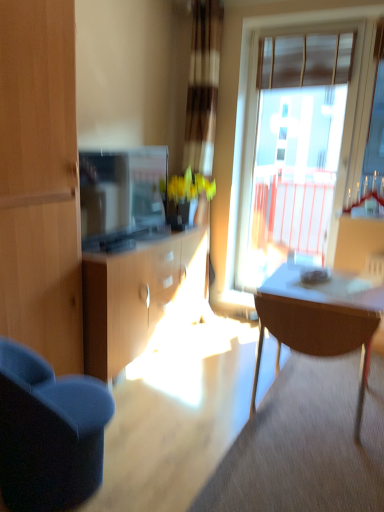
Image resolution: width=384 pixels, height=512 pixels. Describe the element at coordinates (320, 319) in the screenshot. I see `matte brown table at right` at that location.

What is the approximate height of matte brown table at right?

matte brown table at right is 29.57 inches in height.

Identify the location of matte brown table at right. The height and width of the screenshot is (512, 384). (320, 319).

The width and height of the screenshot is (384, 512). In order to click on translucent glass window at upper right in this screenshot , I will do `click(296, 144)`.

Describe the element at coordinates (296, 144) in the screenshot. Image resolution: width=384 pixels, height=512 pixels. I see `translucent glass window at upper right` at that location.

Find the location of `matte brown table at right`. matte brown table at right is located at coordinates (320, 319).

In the scene shown: Is matte brown table at right to the right of translucent glass window at upper right from the viewer's perspective?

No, matte brown table at right is not to the right of translucent glass window at upper right.

Which object is further away from the camera taking this photo, matte brown table at right or translucent glass window at upper right?

translucent glass window at upper right.

Does point (313, 294) appear closer or farther from the camera than point (244, 289)?

Point (313, 294) is closer to the camera than point (244, 289).

From the image's perspective, which object appears higher, matte brown table at right or translucent glass window at upper right?

translucent glass window at upper right, from the image's perspective.

From a real-world perspective, is matte brown table at right beneath translucent glass window at upper right?

Yes.

Considering the relative sizes of matte brown table at right and translucent glass window at upper right in the image provided, is matte brown table at right thinner than translucent glass window at upper right?

No, matte brown table at right is not thinner than translucent glass window at upper right.

From their relative heights in the image, would you say matte brown table at right is taller or shorter than translucent glass window at upper right?

In the image, matte brown table at right appears to be shorter than translucent glass window at upper right.

Is matte brown table at right bigger or smaller than translucent glass window at upper right?

In the image, matte brown table at right appears to be larger than translucent glass window at upper right.

Is translucent glass window at upper right located within matte brown table at right?

Actually, translucent glass window at upper right is outside matte brown table at right.

Is the surface of matte brown table at right in direct contact with translucent glass window at upper right?

No, matte brown table at right is not touching translucent glass window at upper right.

Is matte brown table at right oriented away from translucent glass window at upper right?

No, matte brown table at right is not facing away from translucent glass window at upper right.

Locate an element on the screen. This screenshot has width=384, height=512. window located above the matte brown table at right (from a real-world perspective) is located at coordinates (296, 144).

Between translucent glass window at upper right and matte brown table at right, which one appears on the left side from the viewer's perspective?

matte brown table at right.

Does translucent glass window at upper right lie behind matte brown table at right?

→ Yes, it is.

Which point is more distant from viewer, [247,264] or [298,336]?

The point [247,264] is farther.

From the image's perspective, is translucent glass window at upper right beneath matte brown table at right?

No, from the image's perspective, translucent glass window at upper right is not beneath matte brown table at right.

From a real-world perspective, between translucent glass window at upper right and matte brown table at right, who is vertically lower?

matte brown table at right is physically lower.

Considering the sizes of translucent glass window at upper right and matte brown table at right in the image, is translucent glass window at upper right wider or thinner than matte brown table at right?

translucent glass window at upper right is thinner than matte brown table at right.

Between translucent glass window at upper right and matte brown table at right, which one has more height?

translucent glass window at upper right.

Does translucent glass window at upper right have a larger size compared to matte brown table at right?

Incorrect, translucent glass window at upper right is not larger than matte brown table at right.

From the picture: Is translucent glass window at upper right positioned beyond the bounds of matte brown table at right?

Yes.

Are translucent glass window at upper right and matte brown table at right far apart?

translucent glass window at upper right is far away from matte brown table at right.

Looking at this image, is translucent glass window at upper right looking in the opposite direction of matte brown table at right?

translucent glass window at upper right does not have its back to matte brown table at right.

How distant is translucent glass window at upper right from matte brown table at right?

translucent glass window at upper right and matte brown table at right are 1.60 meters apart.

This screenshot has height=512, width=384. What are the coordinates of `window lying behind the matte brown table at right` in the screenshot? It's located at (296, 144).

Where is `kitchen & dining room table that is in front of the translucent glass window at upper right`? Image resolution: width=384 pixels, height=512 pixels. kitchen & dining room table that is in front of the translucent glass window at upper right is located at coordinates tap(320, 319).

Locate an element on the screen. The height and width of the screenshot is (512, 384). window above the matte brown table at right (from a real-world perspective) is located at coordinates (296, 144).